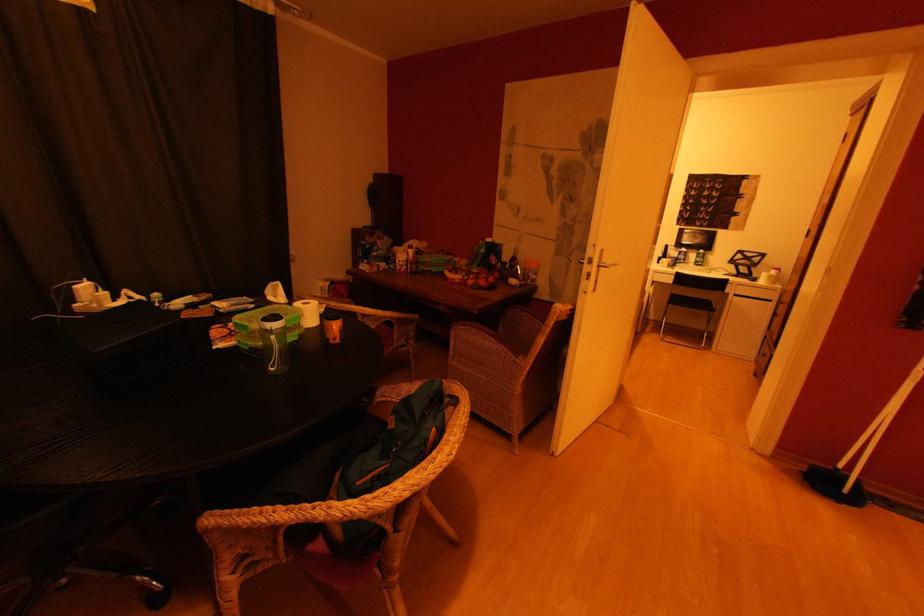
Identify the location of white drawer handle. The width and height of the screenshot is (924, 616). (751, 297).